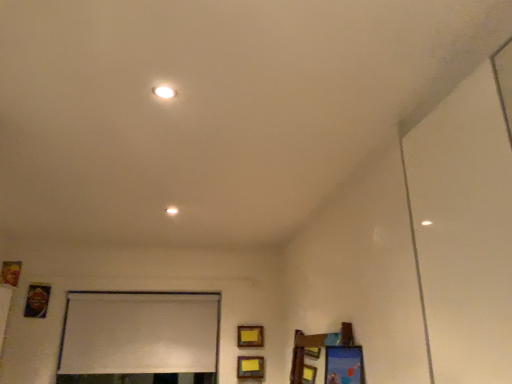
Question: From a real-world perspective, is white glossy light at upper center on top of metallic gold picture frame at lower left, positioned as the 2th picture frame in left-to-right order?

Choices:
 (A) yes
 (B) no

Answer: (A)

Question: Does white glossy light at upper center touch metallic gold picture frame at lower left, which is the 2th picture frame from top to bottom?

Choices:
 (A) yes
 (B) no

Answer: (B)

Question: Is white glossy light at upper center bigger than metallic gold picture frame at lower left, which is the 2th picture frame from top to bottom?

Choices:
 (A) no
 (B) yes

Answer: (A)

Question: Does white glossy light at upper center lie in front of metallic gold picture frame at lower left, the 3th picture frame when ordered from right to left?

Choices:
 (A) yes
 (B) no

Answer: (A)

Question: Can you confirm if white glossy light at upper center is thinner than metallic gold picture frame at lower left, which ranks as the 3th picture frame in bottom-to-top order?

Choices:
 (A) no
 (B) yes

Answer: (A)

Question: Looking at their shapes, would you say wooden picture frame at left, the fourth picture frame positioned from the right, is wider or thinner than matte yellow picture frame at lower center, the second picture frame viewed from the right?

Choices:
 (A) wide
 (B) thin

Answer: (A)

Question: Considering their positions, is wooden picture frame at left, the first picture frame viewed from the left, located in front of or behind matte yellow picture frame at lower center, the 4th picture frame positioned from the top?

Choices:
 (A) behind
 (B) front

Answer: (B)

Question: Is wooden picture frame at left, the first picture frame viewed from the left, inside or outside of matte yellow picture frame at lower center, the 4th picture frame positioned from the top?

Choices:
 (A) outside
 (B) inside

Answer: (A)

Question: Is wooden picture frame at left, the fourth picture frame positioned from the right, taller or shorter than matte yellow picture frame at lower center, the second picture frame viewed from the right?

Choices:
 (A) tall
 (B) short

Answer: (A)

Question: Looking at their shapes, would you say matte yellow picture frame at lower center, the 4th picture frame positioned from the top, is wider or thinner than wooden picture frame at left, the fourth picture frame positioned from the right?

Choices:
 (A) thin
 (B) wide

Answer: (A)

Question: From the image's perspective, is matte yellow picture frame at lower center, the second picture frame viewed from the right, located above or below wooden picture frame at left, arranged as the first picture frame when viewed from the top?

Choices:
 (A) below
 (B) above

Answer: (A)

Question: Looking at the image, does matte yellow picture frame at lower center, the third picture frame viewed from the left, seem bigger or smaller compared to wooden picture frame at left, the fourth picture frame positioned from the right?

Choices:
 (A) small
 (B) big

Answer: (B)

Question: In the image, is matte yellow picture frame at lower center, the third picture frame viewed from the left, positioned in front of or behind wooden picture frame at left, arranged as the first picture frame when viewed from the top?

Choices:
 (A) behind
 (B) front

Answer: (A)

Question: Looking at their shapes, would you say matte yellow picture frame at center, the first picture frame in the right-to-left sequence, is wider or thinner than white matte window screen at lower center?

Choices:
 (A) wide
 (B) thin

Answer: (B)

Question: Is matte yellow picture frame at center, arranged as the 3th picture frame when viewed from the top, spatially inside white matte window screen at lower center, or outside of it?

Choices:
 (A) inside
 (B) outside

Answer: (B)